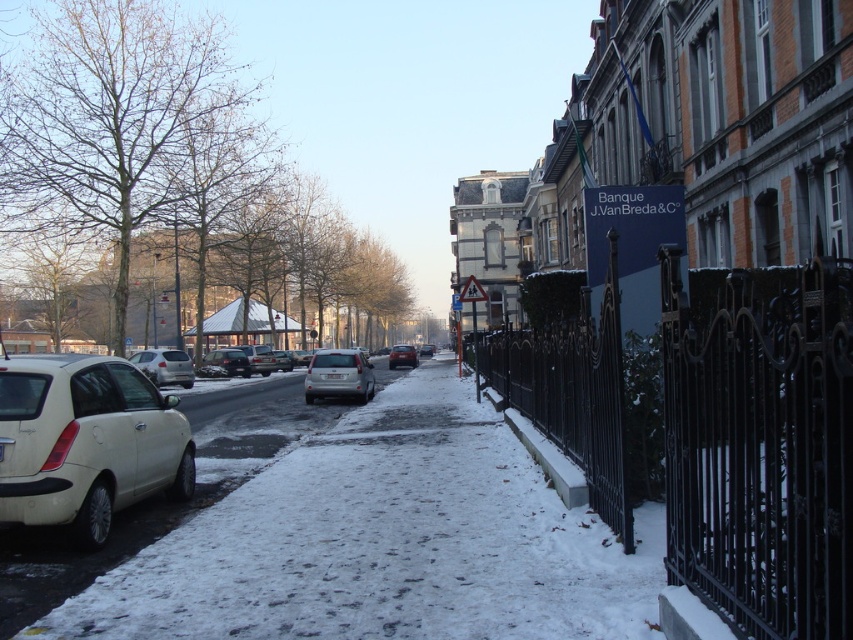
You are a delivery person trying to park your van between the satin silver sedan at center and the shiny red sedan at center. Based on their positions, which direction should you move your van to fit between them?

The satin silver sedan at center is above the shiny red sedan at center, so you should move your van downward to fit between them.

You are a delivery person needing to park your vehicle. You see a satin silver sedan at center and a shiny red sedan at center. Which vehicle is closer to you, the observer, so you can park behind it?

The satin silver sedan at center is in front of the shiny red sedan at center, so the shiny red sedan at center is farther away. Therefore, you can park behind the shiny red sedan at center since it is the one farther back.